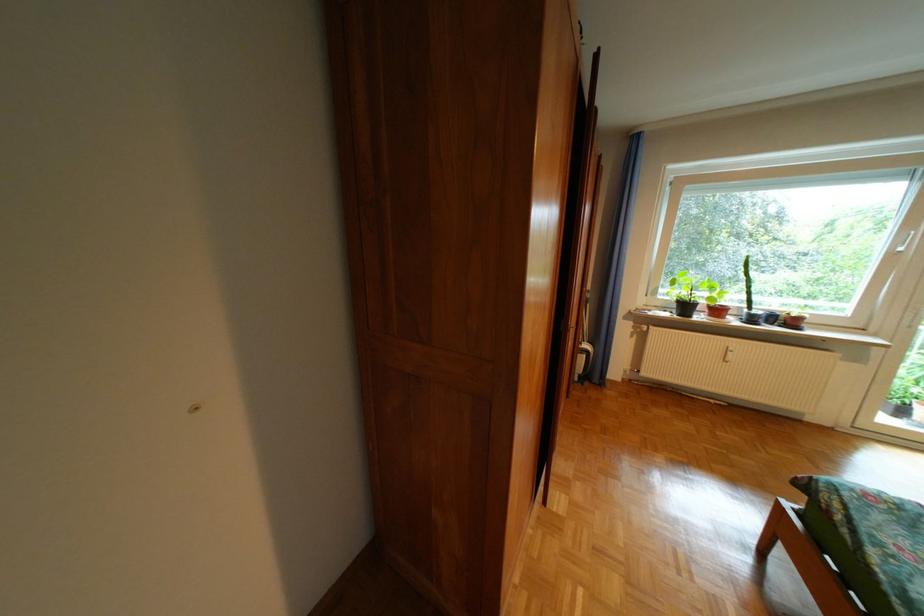
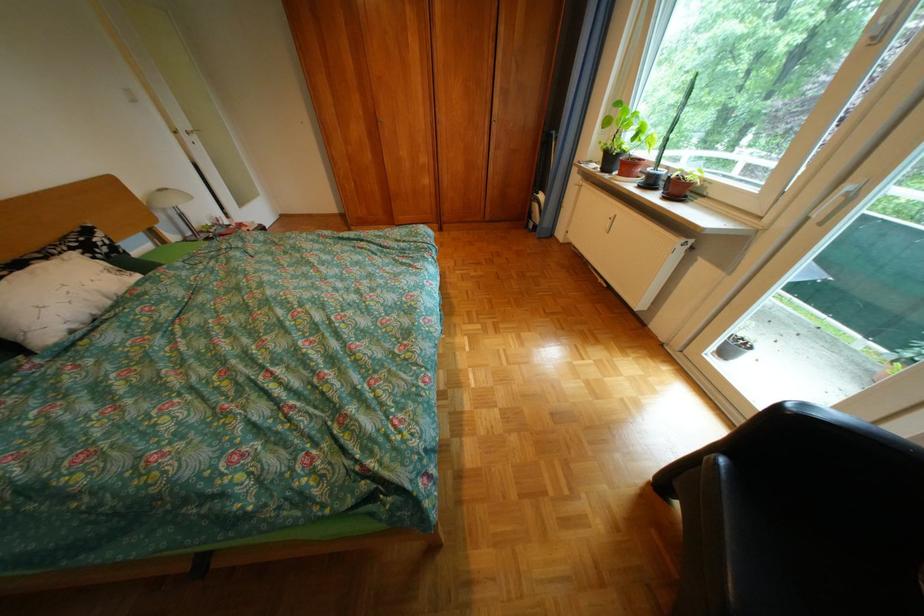
Locate, in the second image, the point that corresponds to [679,315] in the first image.

(610, 168)